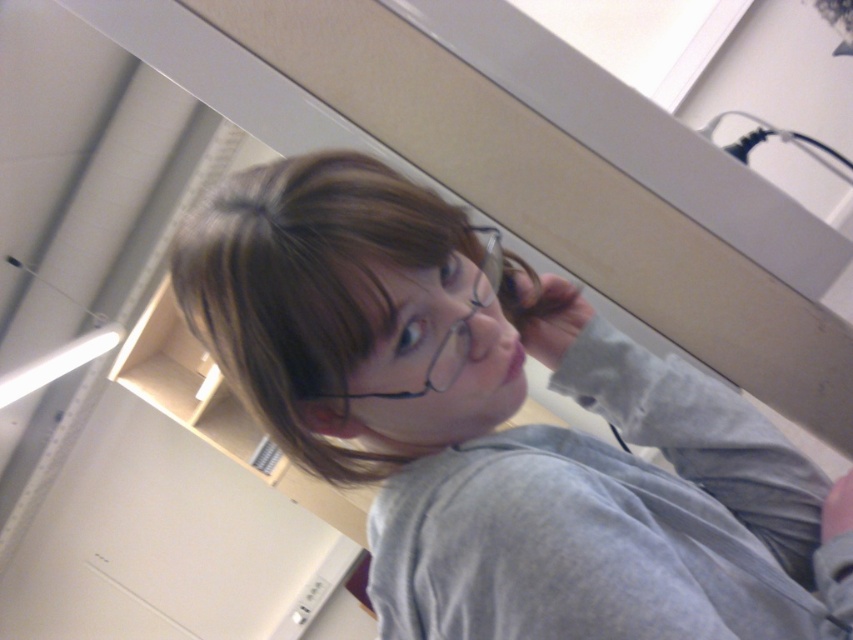
Can you confirm if gray matte shirt at center is positioned below clear plastic glasses at center?

Yes.

How far apart are gray matte shirt at center and clear plastic glasses at center?

gray matte shirt at center and clear plastic glasses at center are 14.41 centimeters apart.

Is point (599, 465) more distant than point (489, 284)?

Yes.

I want to click on gray matte shirt at center, so click(x=498, y=422).

Is the position of brown matte hair at upper center more distant than that of clear plastic glasses at center?

No.

What do you see at coordinates (305, 284) in the screenshot?
I see `brown matte hair at upper center` at bounding box center [305, 284].

You are a GUI agent. You are given a task and a screenshot of the screen. Output one action in this format:
    pyautogui.click(x=<x>, y=<y>)
    Task: Click on the brown matte hair at upper center
    The height and width of the screenshot is (640, 853).
    Given the screenshot: What is the action you would take?
    point(305,284)

I want to click on brown matte hair at upper center, so click(x=305, y=284).

The height and width of the screenshot is (640, 853). What do you see at coordinates (498, 422) in the screenshot?
I see `gray matte shirt at center` at bounding box center [498, 422].

Between point (843, 636) and point (184, 280), which one is positioned behind?

Point (843, 636)

This screenshot has height=640, width=853. I want to click on gray matte shirt at center, so click(x=498, y=422).